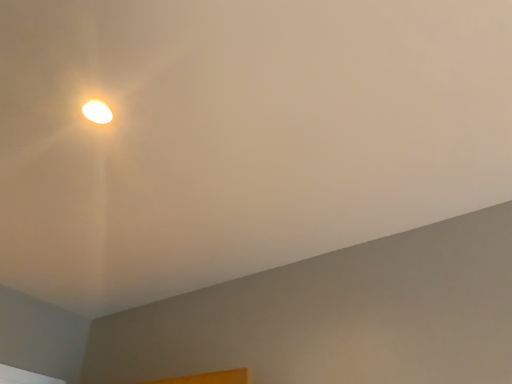
Find the location of a particular element. The image size is (512, 384). matte white light at upper left is located at coordinates (97, 112).

What do you see at coordinates (97, 112) in the screenshot? This screenshot has height=384, width=512. I see `matte white light at upper left` at bounding box center [97, 112].

Find the location of a particular element. The image size is (512, 384). matte white light at upper left is located at coordinates (97, 112).